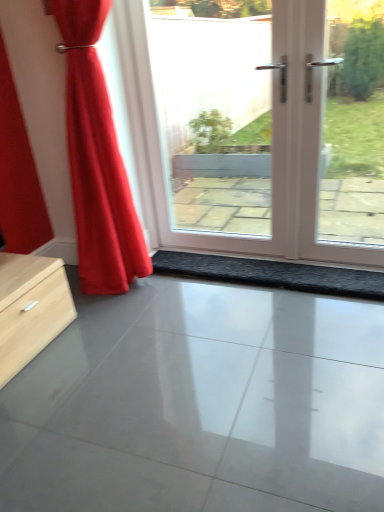
Find the location of a particular element. The height and width of the screenshot is (512, 384). free spot above black textured mat at center (from a real-world perspective) is located at coordinates (264, 262).